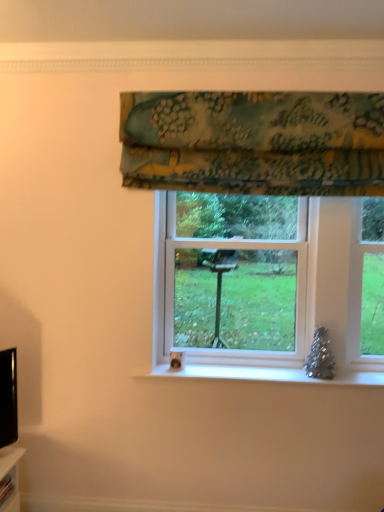
Question: Does textured floral fabric at upper center come behind white plastic window at center?

Choices:
 (A) yes
 (B) no

Answer: (B)

Question: Is textured floral fabric at upper center positioned before white plastic window at center?

Choices:
 (A) yes
 (B) no

Answer: (A)

Question: Does textured floral fabric at upper center have a larger size compared to white plastic window at center?

Choices:
 (A) yes
 (B) no

Answer: (B)

Question: Can you confirm if textured floral fabric at upper center is thinner than white plastic window at center?

Choices:
 (A) yes
 (B) no

Answer: (A)

Question: Considering the relative sizes of textured floral fabric at upper center and white plastic window at center in the image provided, is textured floral fabric at upper center shorter than white plastic window at center?

Choices:
 (A) no
 (B) yes

Answer: (B)

Question: Is textured floral fabric at upper center outside of white plastic window at center?

Choices:
 (A) yes
 (B) no

Answer: (A)

Question: Does white plastic window at center have a greater width compared to textured floral fabric at upper center?

Choices:
 (A) no
 (B) yes

Answer: (B)

Question: Does white plastic window at center have a lesser width compared to textured floral fabric at upper center?

Choices:
 (A) yes
 (B) no

Answer: (B)

Question: Does white plastic window at center appear on the left side of textured floral fabric at upper center?

Choices:
 (A) yes
 (B) no

Answer: (B)

Question: Does white plastic window at center touch textured floral fabric at upper center?

Choices:
 (A) no
 (B) yes

Answer: (A)

Question: Can you confirm if white plastic window at center is shorter than textured floral fabric at upper center?

Choices:
 (A) no
 (B) yes

Answer: (A)

Question: From the image's perspective, is white plastic window at center below textured floral fabric at upper center?

Choices:
 (A) yes
 (B) no

Answer: (A)

Question: From a real-world perspective, is textured floral fabric at upper center positioned above or below white plastic window at center?

Choices:
 (A) below
 (B) above

Answer: (B)